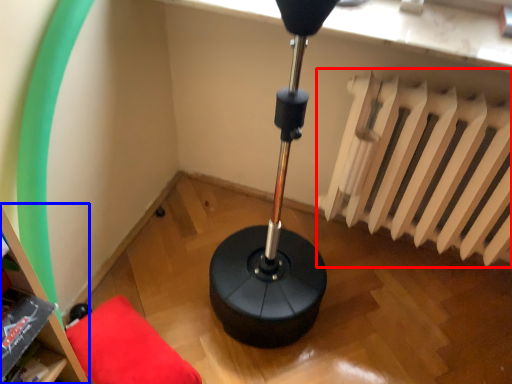
Question: Which point is further to the camera, radiator (highlighted by a red box) or bookshelf (highlighted by a blue box)?

Choices:
 (A) radiator
 (B) bookshelf

Answer: (A)